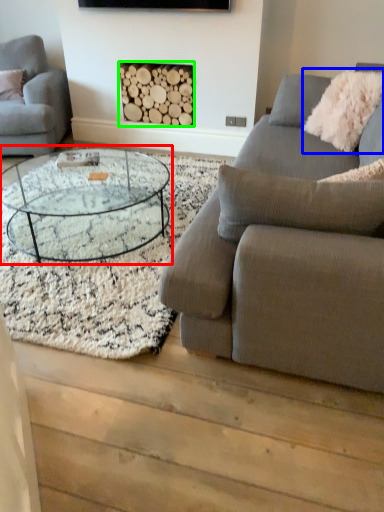
Question: Considering the real-world distances, which object is closest to coffee table (highlighted by a red box)? pillow (highlighted by a blue box) or fireplace (highlighted by a green box).

Choices:
 (A) pillow
 (B) fireplace

Answer: (B)